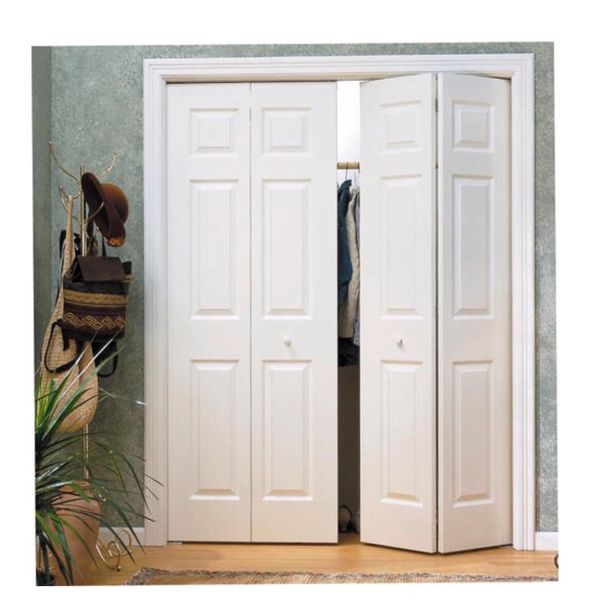
In order to click on trim in this screenshot , I will do `click(545, 536)`.